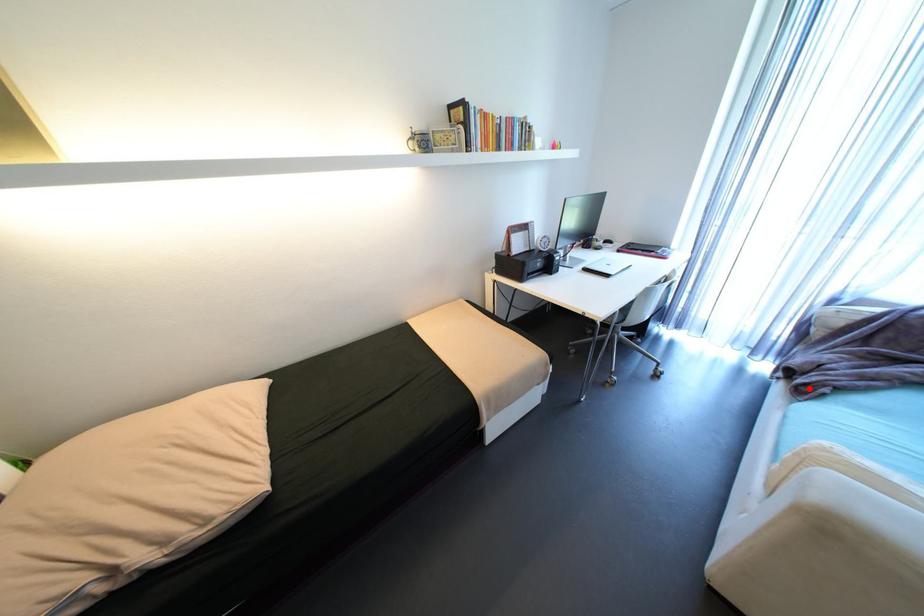
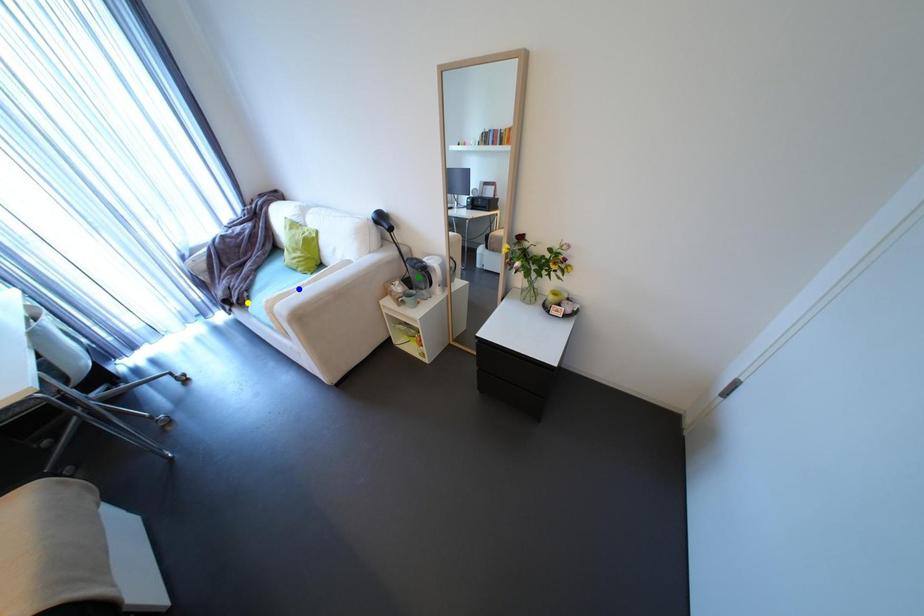
Question: I am providing you with two images of the same scene from different viewpoints. A red point is marked on the first image. You are given multiple points on the second image. In image 2, which mark is for the same physical point as the one in image 1?

Choices:
 (A) yellow point
 (B) green point
 (C) blue point

Answer: (A)